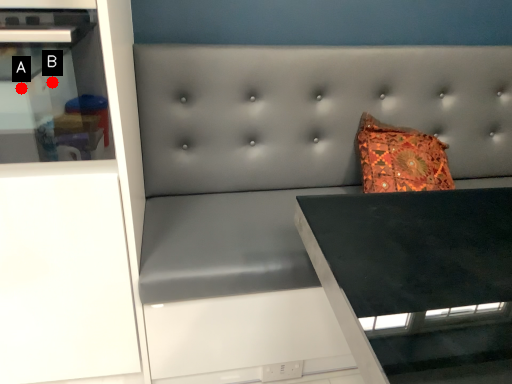
Question: Two points are circled on the image, labeled by A and B beside each circle. Which of the following is the closest to the observer?

Choices:
 (A) A is closer
 (B) B is closer

Answer: (B)